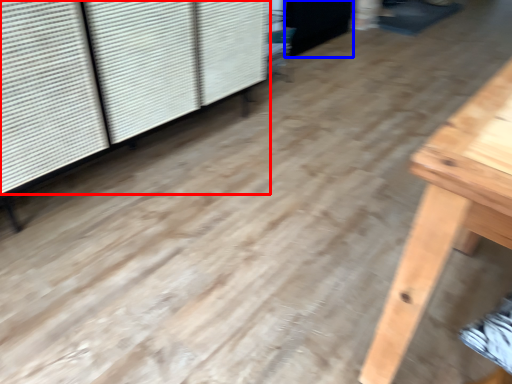
Question: Which object appears closest to the camera in this image, shutter (highlighted by a red box) or screen door (highlighted by a blue box)?

Choices:
 (A) shutter
 (B) screen door

Answer: (A)